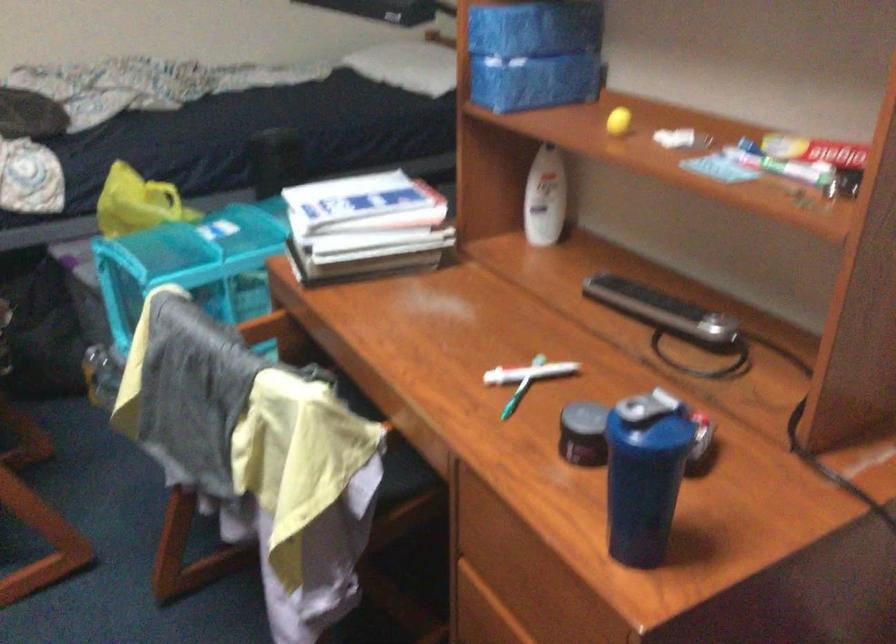
Where would you lift the white lotion bottle? Please return your answer as a coordinate pair (x, y).

(545, 198)